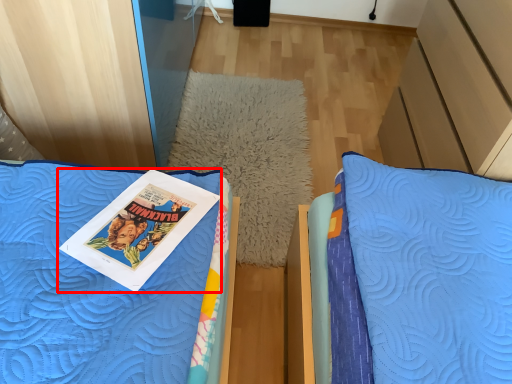
Question: From the image's perspective, considering the relative positions of book (annotated by the red box) and pillow in the image provided, where is book (annotated by the red box) located with respect to the staircase?

Choices:
 (A) above
 (B) below

Answer: (B)